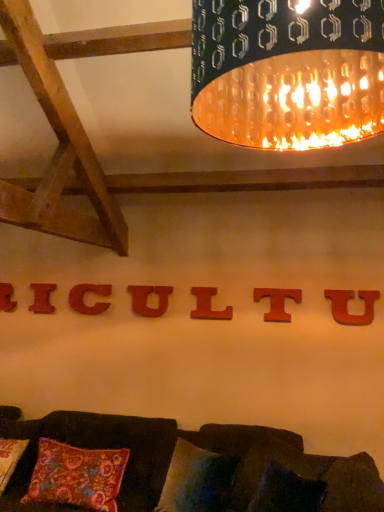
Question: Is matte wood letter u at center, which is counted as the fourth alphabet, starting from the left, facing towards metallic textured lampshade at upper center?

Choices:
 (A) yes
 (B) no

Answer: (B)

Question: Does matte wood letter u at center, which is counted as the fourth alphabet, starting from the left, lie in front of metallic textured lampshade at upper center?

Choices:
 (A) yes
 (B) no

Answer: (B)

Question: From the image's perspective, is matte wood letter u at center, which is counted as the fourth alphabet, starting from the left, over metallic textured lampshade at upper center?

Choices:
 (A) no
 (B) yes

Answer: (A)

Question: Does matte wood letter u at center, placed as the fourth alphabet when sorted from right to left, appear on the right side of metallic textured lampshade at upper center?

Choices:
 (A) yes
 (B) no

Answer: (B)

Question: Considering the relative sizes of matte wood letter u at center, which is counted as the fourth alphabet, starting from the left, and metallic textured lampshade at upper center in the image provided, is matte wood letter u at center, which is counted as the fourth alphabet, starting from the left, wider than metallic textured lampshade at upper center?

Choices:
 (A) yes
 (B) no

Answer: (B)

Question: Which is correct: wooden letter l at center, which is the fifth alphabet in left-to-right order, is inside floral fabric pillow at lower center, acting as the third pillow starting from the left, or outside of it?

Choices:
 (A) outside
 (B) inside

Answer: (A)

Question: In terms of height, does wooden letter l at center, placed as the third alphabet when sorted from right to left, look taller or shorter compared to floral fabric pillow at lower center, acting as the third pillow starting from the left?

Choices:
 (A) tall
 (B) short

Answer: (B)

Question: From the image's perspective, is wooden letter l at center, placed as the third alphabet when sorted from right to left, located above or below floral fabric pillow at lower center, which appears as the first pillow when viewed from the right?

Choices:
 (A) above
 (B) below

Answer: (A)

Question: Is wooden letter l at center, which is the fifth alphabet in left-to-right order, bigger or smaller than floral fabric pillow at lower center, acting as the third pillow starting from the left?

Choices:
 (A) big
 (B) small

Answer: (B)

Question: Based on their sizes in the image, would you say wooden letter at center, the 7th alphabet viewed from the right, is bigger or smaller than velvety floral pillow at lower left, the 3th pillow viewed from the right?

Choices:
 (A) small
 (B) big

Answer: (A)

Question: From a real-world perspective, is wooden letter at center, the 7th alphabet viewed from the right, positioned above or below velvety floral pillow at lower left, the 3th pillow viewed from the right?

Choices:
 (A) above
 (B) below

Answer: (A)

Question: In the image, is wooden letter at center, arranged as the first alphabet when viewed from the left, positioned in front of or behind velvety floral pillow at lower left, placed as the 1th pillow when sorted from left to right?

Choices:
 (A) front
 (B) behind

Answer: (B)

Question: Based on their positions, is wooden letter at center, the 7th alphabet viewed from the right, located to the left or right of velvety floral pillow at lower left, the 3th pillow viewed from the right?

Choices:
 (A) right
 (B) left

Answer: (B)

Question: From a real-world perspective, relative to red wood letter i at center, the 6th alphabet viewed from the right, is wooden letter l at center, which is the fifth alphabet in left-to-right order, vertically above or below?

Choices:
 (A) below
 (B) above

Answer: (B)

Question: From the image's perspective, relative to red wood letter i at center, the 6th alphabet viewed from the right, is wooden letter l at center, which is the fifth alphabet in left-to-right order, above or below?

Choices:
 (A) below
 (B) above

Answer: (B)